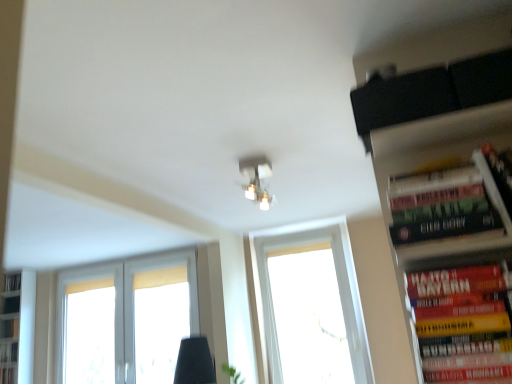
Question: Is hardcover book at right, which ranks as the second book in top-to-bottom order, completely or partially inside matte white light fixture at center?

Choices:
 (A) yes
 (B) no

Answer: (B)

Question: From a real-world perspective, does matte white light fixture at center sit lower than hardcover book at right, the 3th book when ordered from left to right?

Choices:
 (A) no
 (B) yes

Answer: (A)

Question: From a real-world perspective, is matte white light fixture at center physically above hardcover book at right, which is the second book in bottom-to-top order?

Choices:
 (A) no
 (B) yes

Answer: (B)

Question: Can you confirm if matte white light fixture at center is positioned to the left of hardcover book at right, arranged as the first book when viewed from the front?

Choices:
 (A) yes
 (B) no

Answer: (A)

Question: From the image's perspective, is matte white light fixture at center under hardcover book at right, the first book viewed from the right?

Choices:
 (A) no
 (B) yes

Answer: (A)

Question: Is hardcover book at right, which ranks as the third book in back-to-front order, at the back of matte white light fixture at center?

Choices:
 (A) yes
 (B) no

Answer: (B)

Question: Could you tell me if white matte bookshelf at left is turned towards white matte window at lower left, arranged as the 1th window when viewed from the left?

Choices:
 (A) no
 (B) yes

Answer: (A)

Question: Could white matte window at lower left, arranged as the 1th window when viewed from the left, be considered to be inside white matte bookshelf at left?

Choices:
 (A) yes
 (B) no

Answer: (B)

Question: Is white matte bookshelf at left to the left of white matte window at lower left, arranged as the 1th window when viewed from the left, from the viewer's perspective?

Choices:
 (A) no
 (B) yes

Answer: (B)

Question: Does white matte bookshelf at left come in front of white matte window at lower left, arranged as the 1th window when viewed from the left?

Choices:
 (A) yes
 (B) no

Answer: (B)

Question: Is white matte bookshelf at left far away from white matte window at lower left, arranged as the 1th window when viewed from the left?

Choices:
 (A) no
 (B) yes

Answer: (A)

Question: From the image's perspective, does white matte bookshelf at left appear higher than white matte window at lower left, arranged as the 1th window when viewed from the left?

Choices:
 (A) no
 (B) yes

Answer: (A)

Question: Is transparent glass window at center, the first window when ordered from right to left, behind hardcover book at right, arranged as the 1th book when viewed from the top?

Choices:
 (A) no
 (B) yes

Answer: (B)